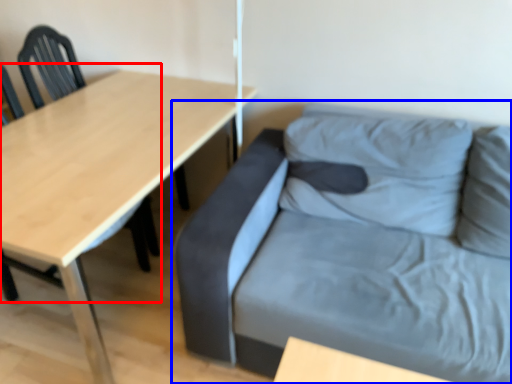
Question: Which object is closer to the camera taking this photo, chair (highlighted by a red box) or studio couch (highlighted by a blue box)?

Choices:
 (A) chair
 (B) studio couch

Answer: (B)